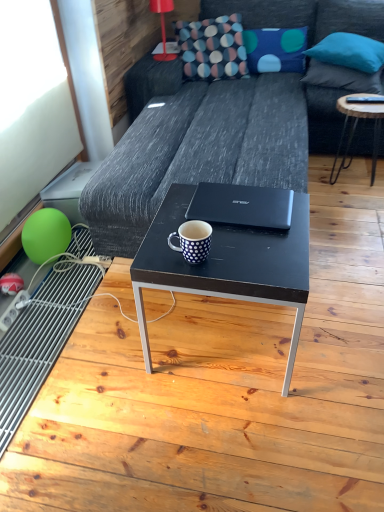
This screenshot has height=512, width=384. In order to click on dark gray fabric couch at center in this screenshot , I will do `click(204, 144)`.

What do you see at coordinates (356, 127) in the screenshot? I see `wooden round table at right` at bounding box center [356, 127].

Where is `black matte coffee table at center`? The width and height of the screenshot is (384, 512). black matte coffee table at center is located at coordinates (227, 264).

Find the location of a particular element. The image size is (384, 512). white dotted mug at center is located at coordinates (192, 240).

In terms of size, does dark gray fabric couch at center appear bigger or smaller than white dotted mug at center?

In the image, dark gray fabric couch at center appears to be larger than white dotted mug at center.

From a real-world perspective, is dark gray fabric couch at center located beneath white dotted mug at center?

Yes, from a real-world perspective, dark gray fabric couch at center is below white dotted mug at center.

Looking at this image, is dark gray fabric couch at center not near white dotted mug at center?

dark gray fabric couch at center is positioned a significant distance from white dotted mug at center.

Considering the sizes of objects teal fabric pillow at upper right, the second pillow in the left-to-right sequence, and green rubber balloon at lower left in the image provided, who is bigger, teal fabric pillow at upper right, the second pillow in the left-to-right sequence, or green rubber balloon at lower left?

With larger size is teal fabric pillow at upper right, the second pillow in the left-to-right sequence.

Are teal fabric pillow at upper right, the 2th pillow in the right-to-left sequence, and green rubber balloon at lower left beside each other?

No, teal fabric pillow at upper right, the 2th pillow in the right-to-left sequence, is not in contact with green rubber balloon at lower left.

From the image's perspective, relative to green rubber balloon at lower left, is teal fabric pillow at upper right, the 2th pillow in the right-to-left sequence, above or below?

Based on their image positions, teal fabric pillow at upper right, the 2th pillow in the right-to-left sequence, is located above green rubber balloon at lower left.

Which is closer to the camera, (350, 36) or (32, 250)?

The point (32, 250) is closer.

Is black matte laptop at center far from wooden round table at right?

That's right, there is a large distance between black matte laptop at center and wooden round table at right.

Is black matte laptop at center oriented towards wooden round table at right?

No, black matte laptop at center is not aimed at wooden round table at right.

Considering the sizes of black matte laptop at center and wooden round table at right in the image, is black matte laptop at center taller or shorter than wooden round table at right?

Clearly, black matte laptop at center is shorter compared to wooden round table at right.

Can you tell me how much black matte laptop at center and teal fabric pillow at upper right, the 2th pillow in the right-to-left sequence, differ in facing direction?

The angular difference between black matte laptop at center and teal fabric pillow at upper right, the 2th pillow in the right-to-left sequence, is 16.3 degrees.

Are black matte laptop at center and teal fabric pillow at upper right, the second pillow in the left-to-right sequence, located far from each other?

That's right, there is a large distance between black matte laptop at center and teal fabric pillow at upper right, the second pillow in the left-to-right sequence.

Is teal fabric pillow at upper right, the 2th pillow in the right-to-left sequence, completely or partially inside black matte laptop at center?

No, teal fabric pillow at upper right, the 2th pillow in the right-to-left sequence, is not surrounded by black matte laptop at center.

Is white dotted mug at center shorter than textured multicolored pillow at upper center?

Yes.

From the image's perspective, between white dotted mug at center and textured multicolored pillow at upper center, which one is located above?

textured multicolored pillow at upper center is shown above in the image.

Is there a large distance between white dotted mug at center and textured multicolored pillow at upper center?

Yes, white dotted mug at center is far from textured multicolored pillow at upper center.

Does white dotted mug at center have a larger size compared to textured multicolored pillow at upper center?

No.

Considering the sizes of objects wooden round table at right and textured multicolored pillow at upper center in the image provided, who is shorter, wooden round table at right or textured multicolored pillow at upper center?

textured multicolored pillow at upper center.

From a real-world perspective, who is located higher, wooden round table at right or textured multicolored pillow at upper center?

textured multicolored pillow at upper center is physically above.

Does point (376, 140) come closer to viewer compared to point (227, 20)?

That is True.

Can you see wooden round table at right touching textured multicolored pillow at upper center?

No, wooden round table at right is not in contact with textured multicolored pillow at upper center.

Is blue fabric pillow at upper right, the 3th pillow in the left-to-right sequence, located outside dark gray fabric couch at center?

blue fabric pillow at upper right, the 3th pillow in the left-to-right sequence, is positioned outside dark gray fabric couch at center.

How different are the orientations of blue fabric pillow at upper right, the first pillow positioned from the right, and dark gray fabric couch at center in degrees?

They differ by 81.6 degrees in their facing directions.

Is blue fabric pillow at upper right, the first pillow positioned from the right, next to dark gray fabric couch at center and touching it?

No, blue fabric pillow at upper right, the first pillow positioned from the right, is not in contact with dark gray fabric couch at center.

Locate an element on the screen. The width and height of the screenshot is (384, 512). coffee cup above the dark gray fabric couch at center (from a real-world perspective) is located at coordinates (192, 240).

Starting from the green rubber balloon at lower left, which pillow is the 1st one behind? Please provide its 2D coordinates.

[(349, 52)]

Considering their positions, is red plastic lamp at upper center positioned further to teal fabric pillow at upper right, the second pillow in the left-to-right sequence, than blue fabric pillow at upper right, the 3th pillow in the left-to-right sequence?

The object further to teal fabric pillow at upper right, the second pillow in the left-to-right sequence, is red plastic lamp at upper center.

When comparing their distances from blue dotted fabric pillow at upper center, the third pillow positioned from the right, does wooden round table at right or teal fabric pillow at upper right, the second pillow in the left-to-right sequence, seem closer?

teal fabric pillow at upper right, the second pillow in the left-to-right sequence, is positioned closer to the anchor blue dotted fabric pillow at upper center, the third pillow positioned from the right.

When comparing their distances from blue dotted fabric pillow at upper center, the 1th pillow when ordered from left to right, does dark gray fabric couch at center or white dotted mug at center seem further?

white dotted mug at center.

Considering their positions, is dark gray fabric couch at center positioned further to teal fabric pillow at upper right, the 2th pillow in the right-to-left sequence, than black matte coffee table at center?

black matte coffee table at center is further to teal fabric pillow at upper right, the 2th pillow in the right-to-left sequence.

When comparing their distances from wooden round table at right, does teal fabric pillow at upper right, the second pillow in the left-to-right sequence, or blue fabric pillow at upper right, the first pillow positioned from the right, seem further?

The object further to wooden round table at right is teal fabric pillow at upper right, the second pillow in the left-to-right sequence.

Based on their spatial positions, is blue dotted fabric pillow at upper center, the 1th pillow when ordered from left to right, or wooden round table at right closer to textured multicolored pillow at upper center?

blue dotted fabric pillow at upper center, the 1th pillow when ordered from left to right, lies closer to textured multicolored pillow at upper center than the other object.

From the picture: Estimate the real-world distances between objects in this image. Which object is closer to black matte laptop at center, red plastic lamp at upper center or white dotted mug at center?

white dotted mug at center is closer to black matte laptop at center.

Based on their spatial positions, is wooden round table at right or dark gray fabric couch at center further from black matte coffee table at center?

wooden round table at right.

Where is `table between green rubber balloon at lower left and teal fabric pillow at upper right, the 2th pillow in the right-to-left sequence`? This screenshot has width=384, height=512. table between green rubber balloon at lower left and teal fabric pillow at upper right, the 2th pillow in the right-to-left sequence is located at coordinates (356, 127).

This screenshot has height=512, width=384. In order to click on laptop between dark gray fabric couch at center and blue fabric pillow at upper right, the 3th pillow in the left-to-right sequence, from front to back in this screenshot , I will do `click(242, 206)`.

Locate an element on the screen. The image size is (384, 512). throw pillow positioned between black matte laptop at center and blue dotted fabric pillow at upper center, the 1th pillow when ordered from left to right, from near to far is located at coordinates (212, 48).

Where is `throw pillow between red plastic lamp at upper center and blue dotted fabric pillow at upper center, the 1th pillow when ordered from left to right`? throw pillow between red plastic lamp at upper center and blue dotted fabric pillow at upper center, the 1th pillow when ordered from left to right is located at coordinates (212, 48).